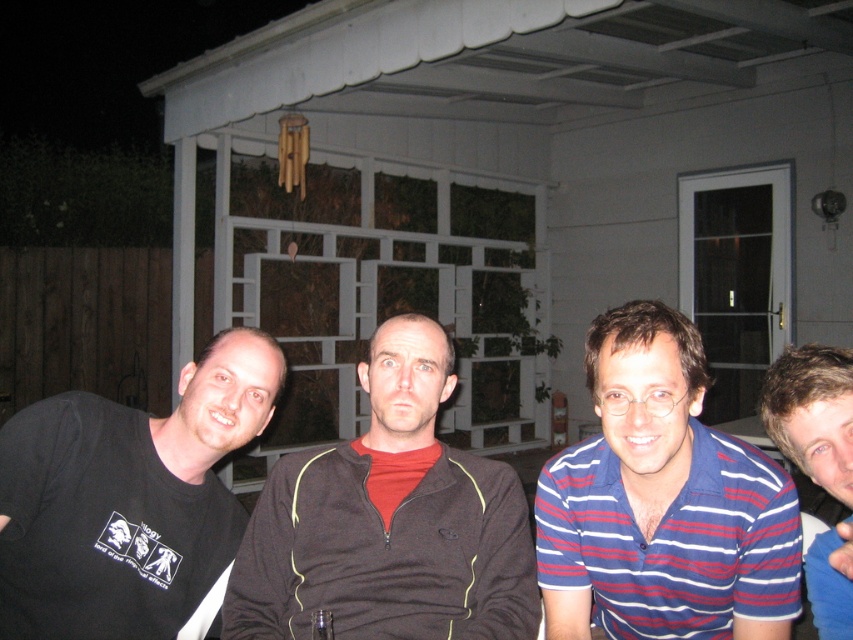
Question: Does blue striped shirt at center lie in front of dark gray zip-up sweater at center?

Choices:
 (A) no
 (B) yes

Answer: (B)

Question: Where is dark gray zip-up sweater at center located in relation to black matte shirt at left in the image?

Choices:
 (A) above
 (B) below

Answer: (B)

Question: Estimate the real-world distances between objects in this image. Which object is farther from the dark gray zip-up sweater at center?

Choices:
 (A) black matte shirt at left
 (B) blue striped shirt at right
 (C) blue striped shirt at center

Answer: (B)

Question: Which point is closer to the camera taking this photo?

Choices:
 (A) (70, 595)
 (B) (694, 572)

Answer: (B)

Question: Which of the following is the closest to the observer?

Choices:
 (A) dark gray zip-up sweater at center
 (B) blue striped shirt at right
 (C) blue striped shirt at center
 (D) black matte shirt at left

Answer: (B)

Question: Where is blue striped shirt at center located in relation to dark gray zip-up sweater at center in the image?

Choices:
 (A) below
 (B) above

Answer: (A)